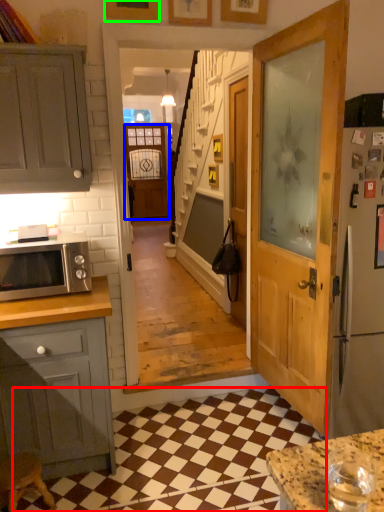
Question: Which object is positioned closest to tile (highlighted by a red box)? Select from screen door (highlighted by a blue box) and picture frame (highlighted by a green box).

Choices:
 (A) screen door
 (B) picture frame

Answer: (B)